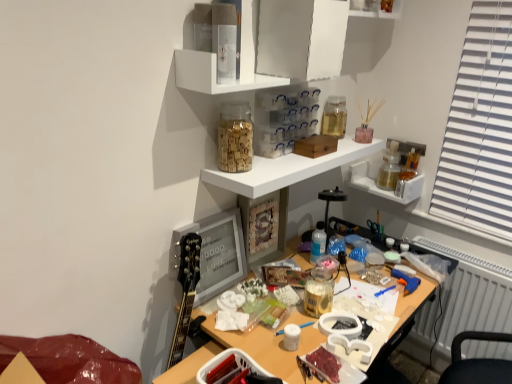
Question: Is white plastic radiator at lower right far away from white glossy shelf at upper center, placed as the 2th shelf when sorted from top to bottom?

Choices:
 (A) no
 (B) yes

Answer: (B)

Question: Can you see white plastic radiator at lower right touching white glossy shelf at upper center, placed as the 2th shelf when sorted from top to bottom?

Choices:
 (A) yes
 (B) no

Answer: (B)

Question: Considering the relative positions of white plastic radiator at lower right and white glossy shelf at upper center, the third shelf from the bottom, in the image provided, is white plastic radiator at lower right to the left of white glossy shelf at upper center, the third shelf from the bottom, from the viewer's perspective?

Choices:
 (A) no
 (B) yes

Answer: (A)

Question: From the image's perspective, would you say white plastic radiator at lower right is shown under white glossy shelf at upper center, the third shelf from the bottom?

Choices:
 (A) no
 (B) yes

Answer: (B)

Question: Is white plastic radiator at lower right taller than white glossy shelf at upper center, placed as the 2th shelf when sorted from top to bottom?

Choices:
 (A) yes
 (B) no

Answer: (A)

Question: Does white plastic radiator at lower right turn towards white glossy shelf at upper center, placed as the 2th shelf when sorted from top to bottom?

Choices:
 (A) no
 (B) yes

Answer: (A)

Question: Does transparent glass jar at upper center, positioned as the first shelf in top-to-bottom order, have a greater height compared to wooden alphabet blocks at upper center, positioned as the second stationery in bottom-to-top order?

Choices:
 (A) no
 (B) yes

Answer: (B)

Question: Can you confirm if transparent glass jar at upper center, the fourth shelf ordered from the bottom, is bigger than wooden alphabet blocks at upper center, arranged as the first stationery when viewed from the left?

Choices:
 (A) no
 (B) yes

Answer: (B)

Question: Can you confirm if transparent glass jar at upper center, the fourth shelf ordered from the bottom, is positioned to the right of wooden alphabet blocks at upper center, positioned as the second stationery in bottom-to-top order?

Choices:
 (A) no
 (B) yes

Answer: (B)

Question: Considering the relative sizes of transparent glass jar at upper center, the fourth shelf ordered from the bottom, and wooden alphabet blocks at upper center, arranged as the first stationery when viewed from the left, in the image provided, is transparent glass jar at upper center, the fourth shelf ordered from the bottom, wider than wooden alphabet blocks at upper center, arranged as the first stationery when viewed from the left,?

Choices:
 (A) no
 (B) yes

Answer: (B)

Question: Could you tell me if transparent glass jar at upper center, the fourth shelf ordered from the bottom, is facing wooden alphabet blocks at upper center, which is counted as the second stationery, starting from the back?

Choices:
 (A) no
 (B) yes

Answer: (A)

Question: Is transparent glass jar at upper center, positioned as the first shelf in top-to-bottom order, looking in the opposite direction of wooden alphabet blocks at upper center, arranged as the first stationery when viewed from the left?

Choices:
 (A) yes
 (B) no

Answer: (B)

Question: From a real-world perspective, does transparent glass jar at upper center, positioned as the first shelf in top-to-bottom order, stand above white glossy shelf at upper center, the third shelf from the bottom?

Choices:
 (A) yes
 (B) no

Answer: (A)